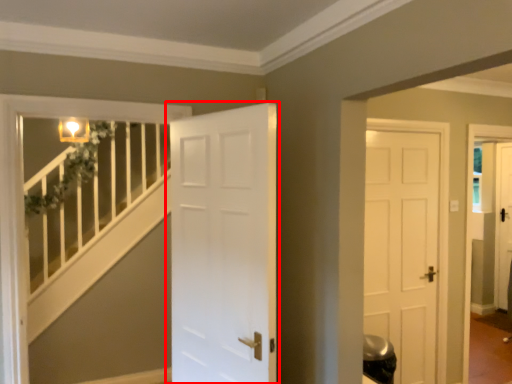
Question: From the image's perspective, considering the relative positions of door (annotated by the red box) and balustrade in the image provided, where is door (annotated by the red box) located with respect to the staircase?

Choices:
 (A) below
 (B) above

Answer: (B)